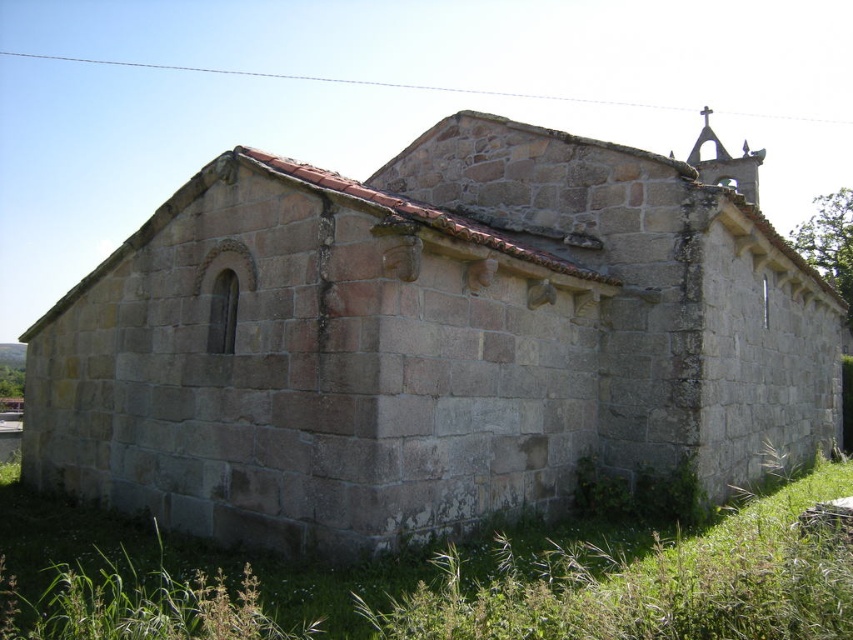
Which of these two, gray stone church at center or green grass at lower right, stands taller?

Standing taller between the two is gray stone church at center.

Between gray stone church at center and green grass at lower right, which one is positioned higher?

gray stone church at center

The image size is (853, 640). What are the coordinates of `gray stone church at center` in the screenshot? It's located at (431, 340).